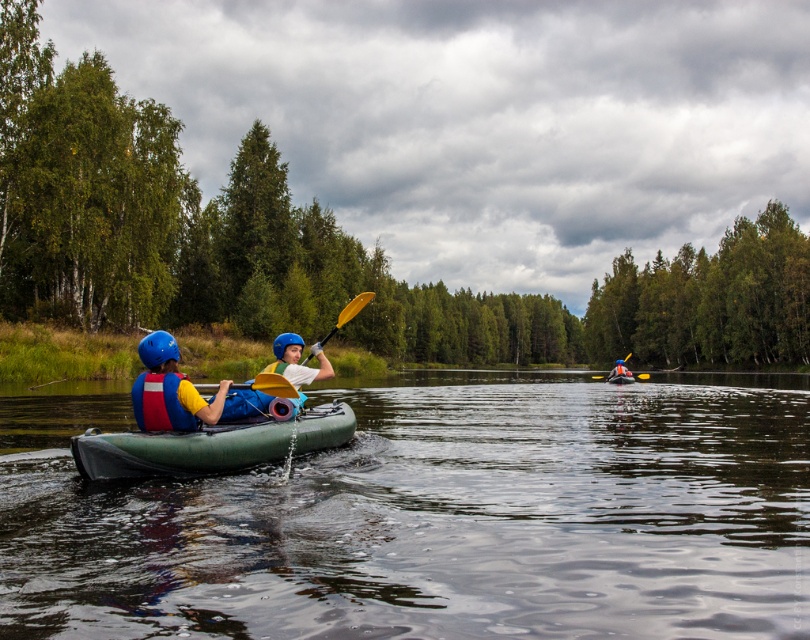
Is point (252, 435) farther from camera compared to point (612, 372)?

That is False.

Which is below, green rubber canoe at left or blue helmet at center?

blue helmet at center is below.

Who is more forward, [215,438] or [629,372]?

Point [215,438] is in front.

Where is `green rubber canoe at left`? green rubber canoe at left is located at coordinates 210,445.

Can you confirm if green rubber kayak at center is positioned to the left of green rubber canoe at center?

Correct, you'll find green rubber kayak at center to the left of green rubber canoe at center.

Does green rubber kayak at center have a smaller size compared to green rubber canoe at center?

No.

Who is more forward, (x=676, y=467) or (x=627, y=378)?

Point (x=676, y=467) is in front.

What are the coordinates of `green rubber kayak at center` in the screenshot? It's located at (433, 516).

Consider the image. Who is taller, matte blue helmet at left or yellow plastic paddle at center?

yellow plastic paddle at center is taller.

Based on the photo, is matte blue helmet at left to the right of yellow plastic paddle at center from the viewer's perspective?

In fact, matte blue helmet at left is to the left of yellow plastic paddle at center.

The height and width of the screenshot is (640, 810). I want to click on matte blue helmet at left, so click(x=169, y=388).